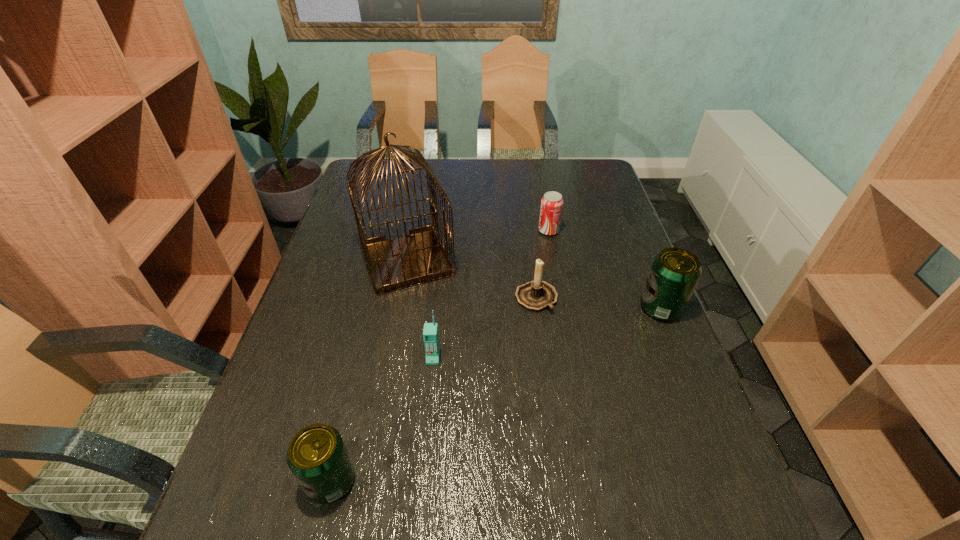
In order to click on free space that satisfies the following two spatial constraints: 1. on the back side of the rightmost object; 2. on the right side of the shorter beer can in this screenshot , I will do `click(372, 308)`.

This screenshot has width=960, height=540. Identify the location of free space that satisfies the following two spatial constraints: 1. on the front side of the candle holder; 2. on the left side of the tallest object. (399, 299).

Locate an element on the screen. The width and height of the screenshot is (960, 540). free space that satisfies the following two spatial constraints: 1. on the logo side of the soda can; 2. on the front side of the tallest object is located at coordinates (554, 260).